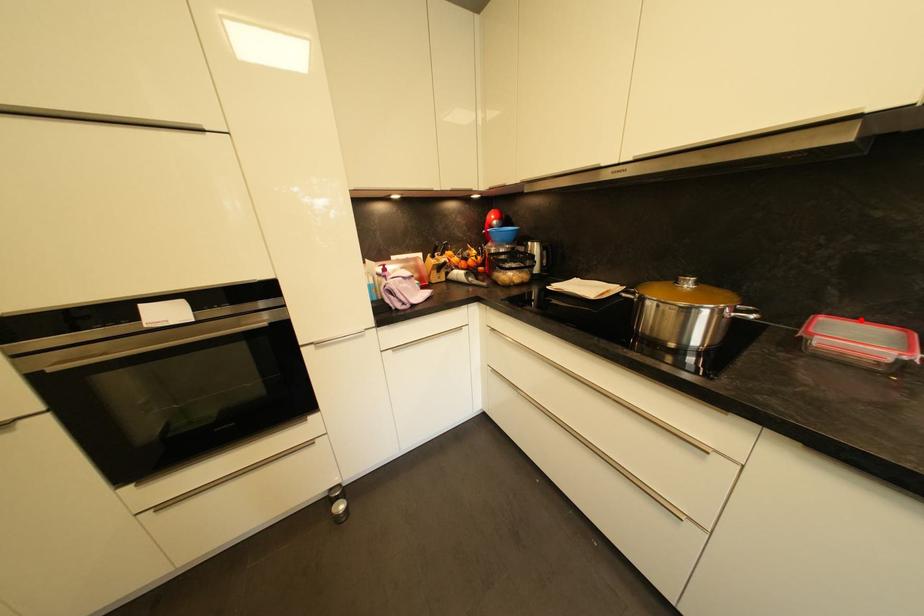
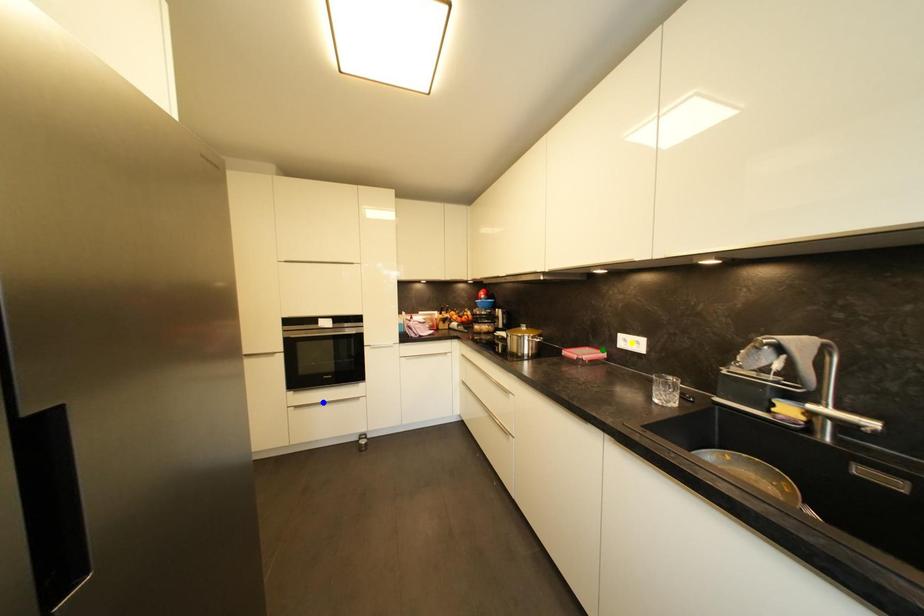
Question: I am providing you with two images of the same scene from different viewpoints. A red point is marked on the first image. You are given multiple points on the second image. Which point in image 2 is actually the same real-world point as the red point in image 1?

Choices:
 (A) yellow point
 (B) blue point
 (C) green point

Answer: (C)